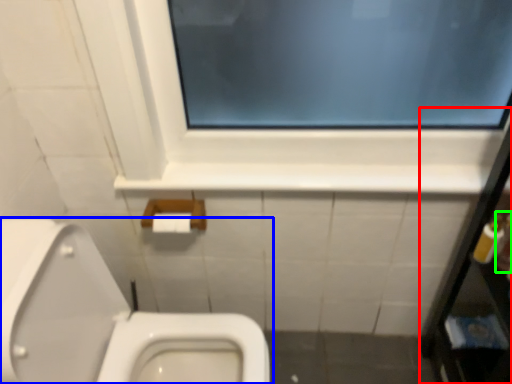
Question: Estimate the real-world distances between objects in this image. Which object is closer to medicine cabinet (highlighted by a red box), toilet (highlighted by a blue box) or toiletry (highlighted by a green box)?

Choices:
 (A) toilet
 (B) toiletry

Answer: (B)